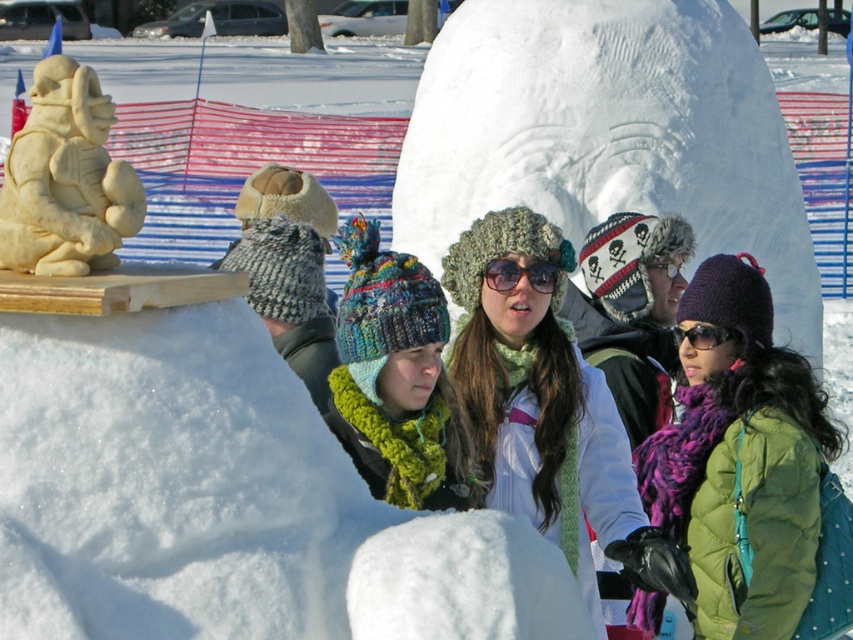
Question: Can you confirm if white knit hat at center is smaller than clear plastic goggles at center?

Choices:
 (A) yes
 (B) no

Answer: (B)

Question: Which object appears farthest from the camera in this image?

Choices:
 (A) multicolored knitted hat at center
 (B) purple fuzzy scarf at center
 (C) light beige snowman at upper left

Answer: (B)

Question: Estimate the real-world distances between objects in this image. Which object is farther from the purple fuzzy scarf at center?

Choices:
 (A) sunglasses at center
 (B) clear plastic goggles at center
 (C) white fluffy snowman at center

Answer: (C)

Question: Does purple fuzzy scarf at center appear on the right side of sunglasses at center?

Choices:
 (A) yes
 (B) no

Answer: (A)

Question: Which point appears closest to the camera in this image?

Choices:
 (A) (650, 275)
 (B) (833, 442)
 (C) (33, 81)

Answer: (C)

Question: Does light beige snowman at upper left appear on the right side of black plastic goggles at center?

Choices:
 (A) yes
 (B) no

Answer: (B)